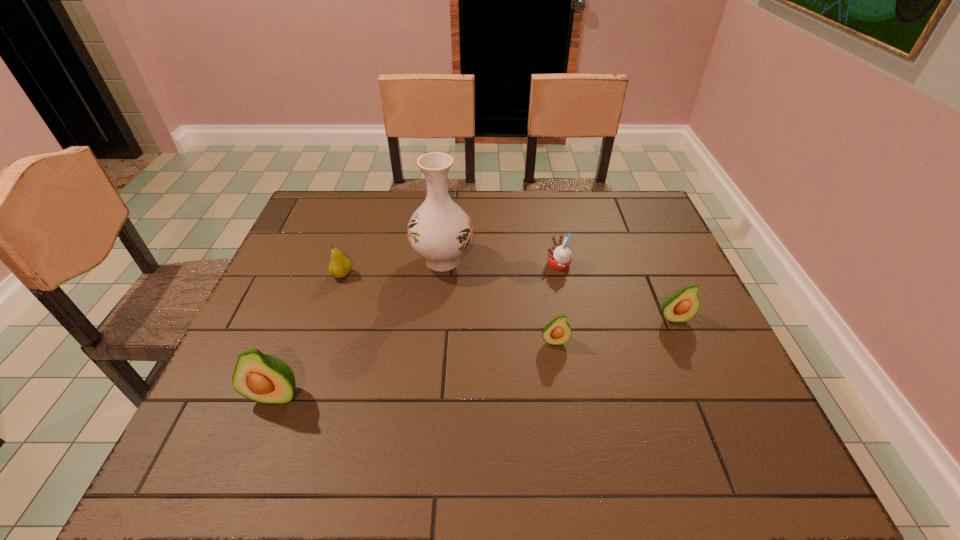
At what (x,y) coordinates should I click in order to perform the action: click on free space for an extra avocado to achieve even spacing. Please return your answer as a coordinate pair (x, y). This screenshot has height=540, width=960. Looking at the image, I should click on (422, 367).